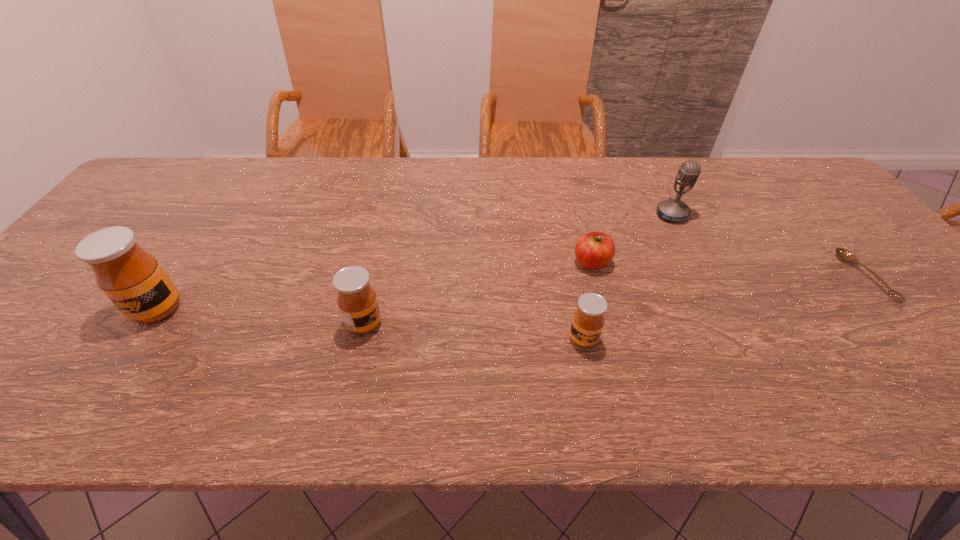
Locate an element on the screen. free point that satisfies the following two spatial constraints: 1. on the front-facing side of the shortest object; 2. on the left side of the fifth object from left to right is located at coordinates (703, 277).